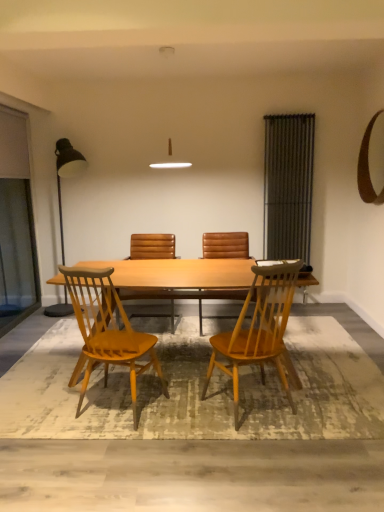
The height and width of the screenshot is (512, 384). I want to click on vacant space that is in between light brown wood chair at center, the first chair from the front, and matte wood chair at center, the 3th chair in the back-to-front sequence, so click(x=187, y=411).